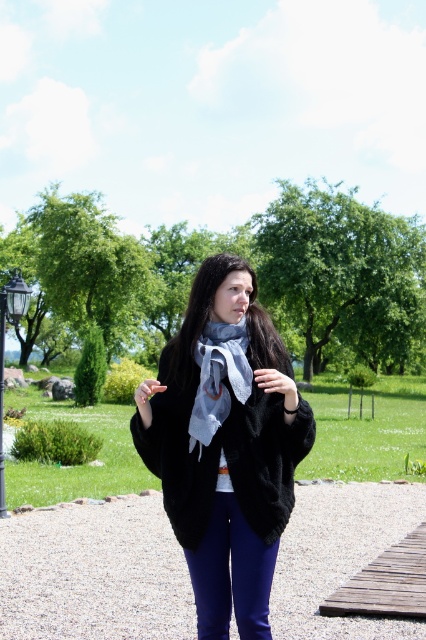
Question: Is gravel at center closer to camera compared to black metal lamp post at lower left?

Choices:
 (A) yes
 (B) no

Answer: (A)

Question: Which object is closer to the camera taking this photo?

Choices:
 (A) light blue sheer scarf at center
 (B) gravel at center
 (C) black metal lamp post at lower left
 (D) black fuzzy coat at center

Answer: (D)

Question: Can you confirm if gravel at center is wider than light blue sheer scarf at center?

Choices:
 (A) yes
 (B) no

Answer: (A)

Question: Is black fuzzy coat at center below light blue sheer scarf at center?

Choices:
 (A) no
 (B) yes

Answer: (B)

Question: Which point is farther from the camera taking this photo?

Choices:
 (A) 20,296
 (B) 423,632

Answer: (A)

Question: Which point is farther to the camera?

Choices:
 (A) (11, 301)
 (B) (152, 410)

Answer: (A)